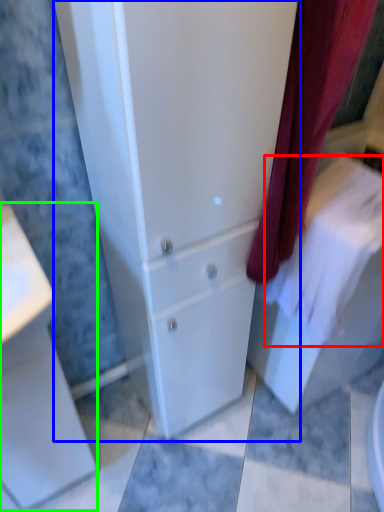
Question: Which is nearer to the bath towel (highlighted by a red box)? bathroom cabinet (highlighted by a blue box) or porcelain (highlighted by a green box).

Choices:
 (A) bathroom cabinet
 (B) porcelain

Answer: (A)